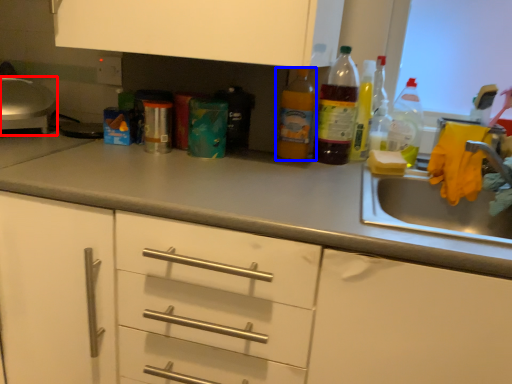
Question: Which object appears closest to the camera in this image, appliance (highlighted by a red box) or bottle (highlighted by a blue box)?

Choices:
 (A) appliance
 (B) bottle

Answer: (A)